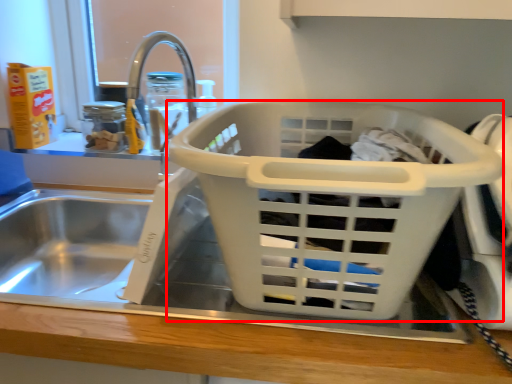
Question: From the image's perspective, where is basket (annotated by the red box) located in relation to bottle in the image?

Choices:
 (A) below
 (B) above

Answer: (A)